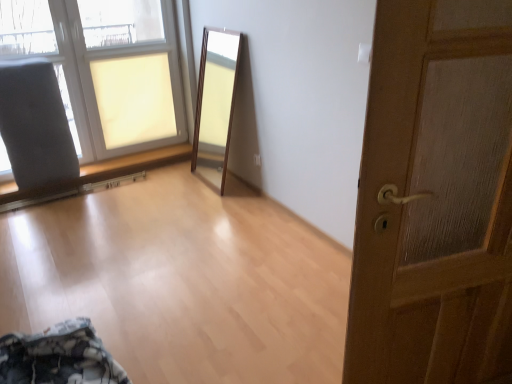
Question: In terms of height, does wooden door at right look taller or shorter compared to gray fabric armchair at left?

Choices:
 (A) short
 (B) tall

Answer: (B)

Question: Is wooden door at right inside the boundaries of gray fabric armchair at left, or outside?

Choices:
 (A) inside
 (B) outside

Answer: (B)

Question: Which object is positioned farthest from the gray fabric armchair at left?

Choices:
 (A) matte glass window at upper left
 (B) wooden door at right

Answer: (B)

Question: Estimate the real-world distances between objects in this image. Which object is closer to the gray fabric armchair at left?

Choices:
 (A) wooden door at right
 (B) matte glass window at upper left

Answer: (B)